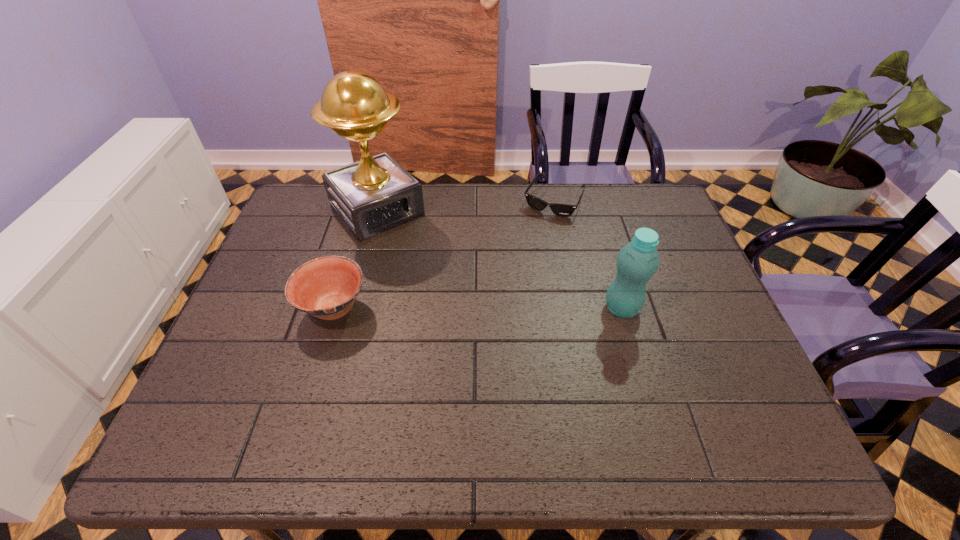
The width and height of the screenshot is (960, 540). Identify the location of the second shortest object. (326, 287).

Locate an element on the screen. The width and height of the screenshot is (960, 540). the second tallest object is located at coordinates (637, 261).

The height and width of the screenshot is (540, 960). In order to click on sunglasses in this screenshot , I will do `click(564, 210)`.

Locate an element on the screen. This screenshot has width=960, height=540. the tallest object is located at coordinates (376, 194).

You are a GUI agent. You are given a task and a screenshot of the screen. Output one action in this format:
    pyautogui.click(x=<x>, y=<y>)
    Task: Click on the vacant space located on the left of the third tallest object
    The width and height of the screenshot is (960, 540).
    Given the screenshot: What is the action you would take?
    pyautogui.click(x=250, y=307)

At what (x,y) coordinates should I click in order to perform the action: click on free location located at the front cap of the second tallest object. Please return your answer as a coordinate pair (x, y). Looking at the image, I should click on (635, 354).

Identify the location of vacant area situated 0.050m on the front-facing side of the shortest object. This screenshot has height=540, width=960. (538, 227).

Where is `free space located on the front-facing side of the shortest object`? The height and width of the screenshot is (540, 960). free space located on the front-facing side of the shortest object is located at coordinates (517, 264).

I want to click on vacant space located on the front-facing side of the shortest object, so click(x=517, y=264).

The width and height of the screenshot is (960, 540). In order to click on vacant space located on the front-facing side of the tallest object in this screenshot , I will do `click(478, 322)`.